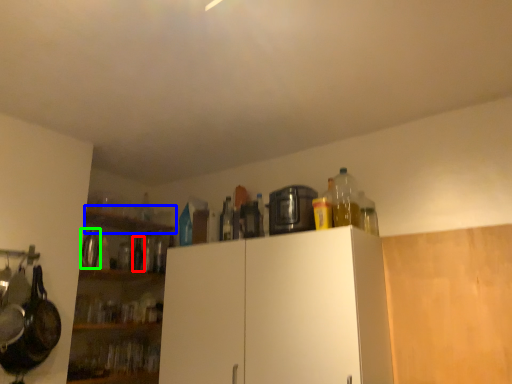
Question: Estimate the real-world distances between objects in this image. Which object is farther from bottle (highlighted by a red box), shelf (highlighted by a blue box) or appliance (highlighted by a green box)?

Choices:
 (A) shelf
 (B) appliance

Answer: (B)